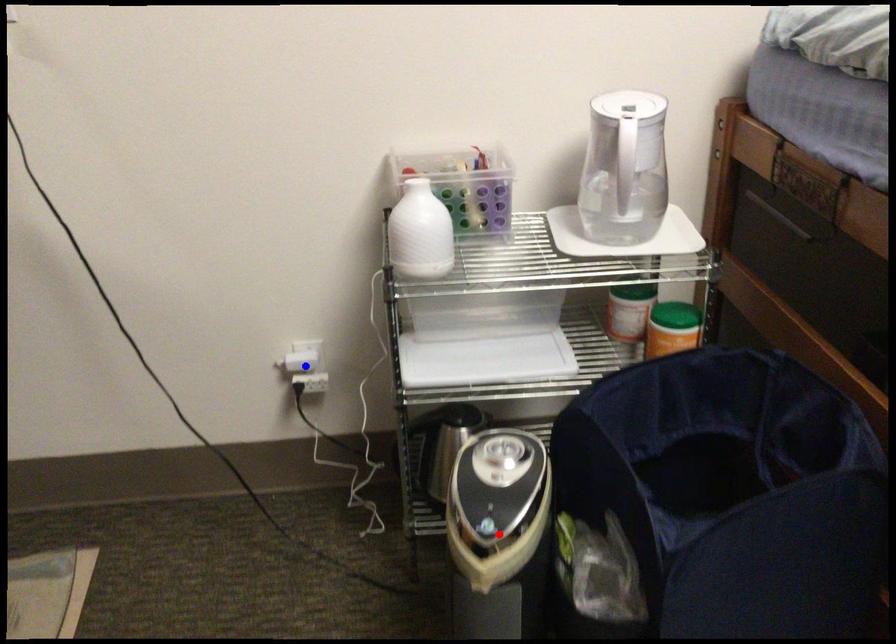
Question: In the image, two points are highlighted. Which point is nearer to the camera? Reply with the corresponding letter.

Choices:
 (A) blue point
 (B) red point

Answer: (B)